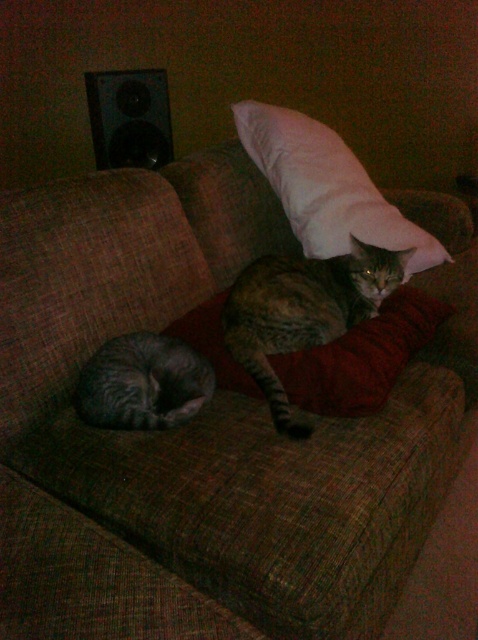
Question: Which object is the closest to the tabby fur cat at center?

Choices:
 (A) black plastic speaker at upper left
 (B) white soft pillow at upper center
 (C) gray striped cat at lower left

Answer: (C)

Question: Estimate the real-world distances between objects in this image. Which object is farther from the white soft pillow at upper center?

Choices:
 (A) black plastic speaker at upper left
 (B) tabby fur cat at center
 (C) gray striped cat at lower left

Answer: (C)

Question: Is tabby fur cat at center to the left of white soft pillow at upper center from the viewer's perspective?

Choices:
 (A) no
 (B) yes

Answer: (B)

Question: Which point is closer to the camera?

Choices:
 (A) tabby fur cat at center
 (B) white soft pillow at upper center

Answer: (A)

Question: Considering the relative positions of white soft pillow at upper center and gray striped cat at lower left in the image provided, where is white soft pillow at upper center located with respect to gray striped cat at lower left?

Choices:
 (A) below
 (B) above

Answer: (B)

Question: Can you confirm if gray striped cat at lower left is wider than black plastic speaker at upper left?

Choices:
 (A) no
 (B) yes

Answer: (A)